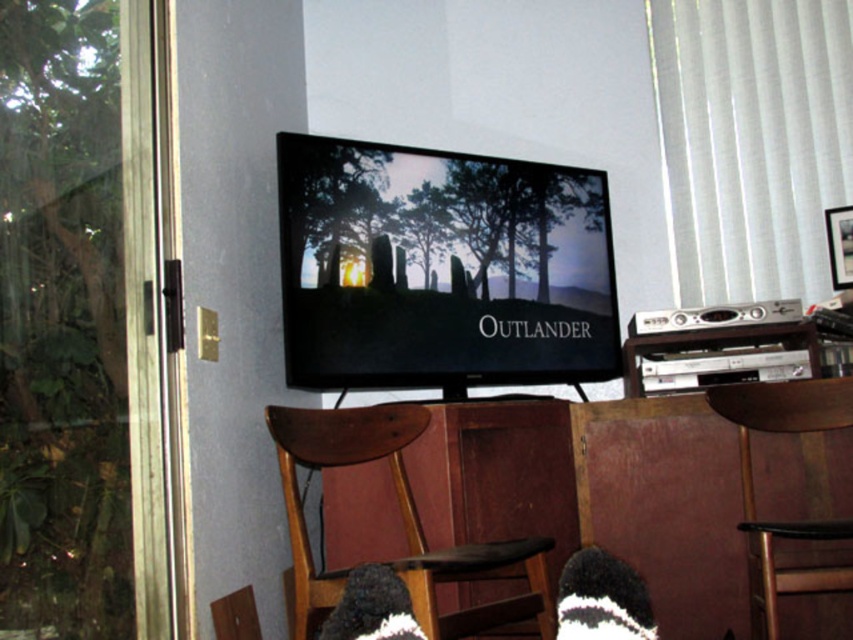
The width and height of the screenshot is (853, 640). I want to click on transparent glass door at left, so click(79, 324).

Which is behind, point (86, 131) or point (521, 355)?

The point (521, 355) is behind.

Locate an element on the screen. The image size is (853, 640). transparent glass door at left is located at coordinates (79, 324).

Can you confirm if clear glass screen door at left is positioned below brown wood armchair at lower center?

Actually, clear glass screen door at left is above brown wood armchair at lower center.

Who is more forward, (x=138, y=394) or (x=817, y=413)?

Positioned in front is point (x=138, y=394).

Which is behind, point (154, 428) or point (756, 397)?

Point (756, 397)

This screenshot has height=640, width=853. What are the coordinates of `clear glass screen door at left` in the screenshot? It's located at (154, 323).

Is point (4, 147) more distant than point (637, 632)?

Yes, point (4, 147) is farther from viewer.

Is transparent glass door at left to the right of black knitted sock at lower center from the viewer's perspective?

Incorrect, transparent glass door at left is not on the right side of black knitted sock at lower center.

What do you see at coordinates (79, 324) in the screenshot? I see `transparent glass door at left` at bounding box center [79, 324].

In order to click on transparent glass door at left in this screenshot , I will do [x=79, y=324].